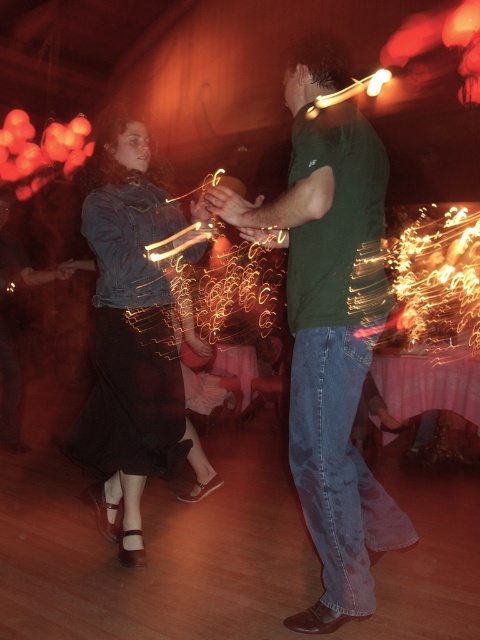
Can you confirm if green matte shirt at center is positioned above denim jacket at left?

Indeed, green matte shirt at center is positioned over denim jacket at left.

Based on the photo, is green matte shirt at center taller than denim jacket at left?

Correct, green matte shirt at center is much taller as denim jacket at left.

Between point (357, 132) and point (99, 156), which one is positioned in front?

Point (357, 132) is more forward.

Identify the location of green matte shirt at center. (328, 326).